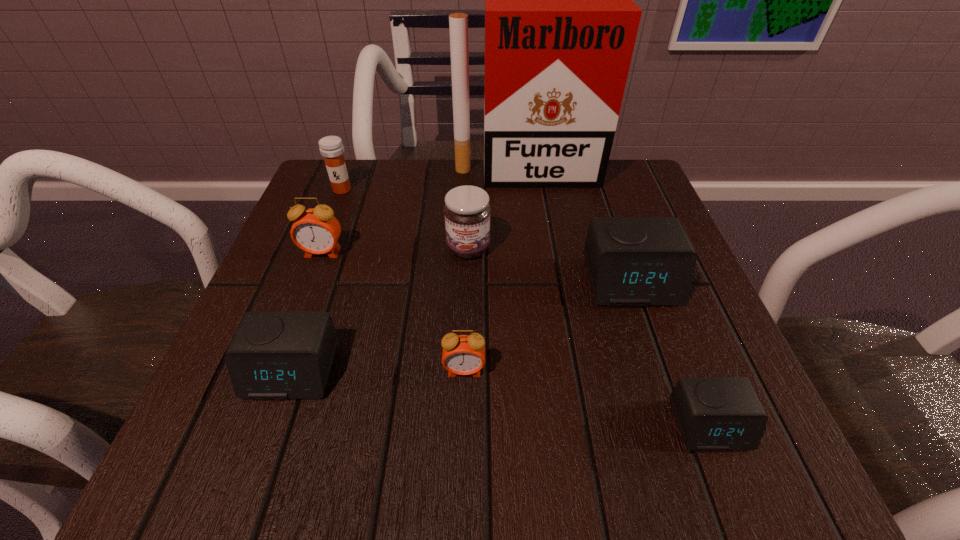
I want to click on unoccupied area between the red cigarette case and the medicine, so click(434, 182).

Find the location of a particular element. free area in between the second smallest black alarm clock and the cigarette case is located at coordinates (409, 273).

Where is `vacant space in between the leftmost black alarm clock and the jam`? This screenshot has width=960, height=540. vacant space in between the leftmost black alarm clock and the jam is located at coordinates (380, 310).

I want to click on object that is the fourth closest one to the medicine, so click(274, 355).

Where is `object that is the seventh closest one to the second biggest black alarm clock`? The image size is (960, 540). object that is the seventh closest one to the second biggest black alarm clock is located at coordinates (713, 413).

Locate an element on the screen. alarm clock that stands as the second closest to the biggest black alarm clock is located at coordinates (462, 354).

Locate an element on the screen. alarm clock that is the fifth closest to the tallest object is located at coordinates (713, 413).

I want to click on black alarm clock that is the second closest to the smaller pink alarm clock, so click(x=632, y=261).

The image size is (960, 540). I want to click on black alarm clock object that ranks as the closest to the medicine, so coord(274,355).